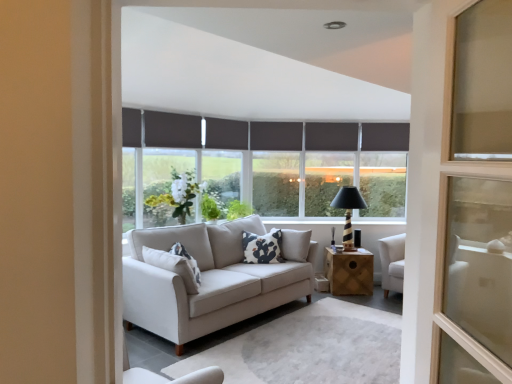
Question: Relative to dark gray roller blind at upper center, arranged as the first window when viewed from the right, is dark grey fabric curtain at center, the third curtain viewed from the front, in front or behind?

Choices:
 (A) behind
 (B) front

Answer: (B)

Question: Is dark grey fabric curtain at center, placed as the 1th curtain when sorted from right to left, bigger or smaller than dark gray roller blind at upper center, arranged as the first window when viewed from the right?

Choices:
 (A) big
 (B) small

Answer: (B)

Question: Considering the real-world distances, which object is closest to the dark gray roller blind at upper center, arranged as the first window when viewed from the right?

Choices:
 (A) black striped wood table lamp at center
 (B) white printed cushion at center
 (C) dark grey fabric curtain at upper center, the first curtain in the front-to-back sequence
 (D) dark gray roller blind at center, the 4th window from the right
 (E) dark gray roller blind at center, the fourth window positioned from the left

Answer: (A)

Question: Estimate the real-world distances between objects in this image. Which object is closer to the dark gray roller blind at center, the fourth window positioned from the left?

Choices:
 (A) dark gray roller blind at center, the second window in the left-to-right sequence
 (B) dark gray roller blind at upper center, arranged as the fifth window when viewed from the left
 (C) black striped wood table lamp at center
 (D) dark grey fabric curtain at center, acting as the 2th curtain starting from the right
 (E) dark gray roller blind at center, arranged as the 3th window when viewed from the right

Answer: (C)